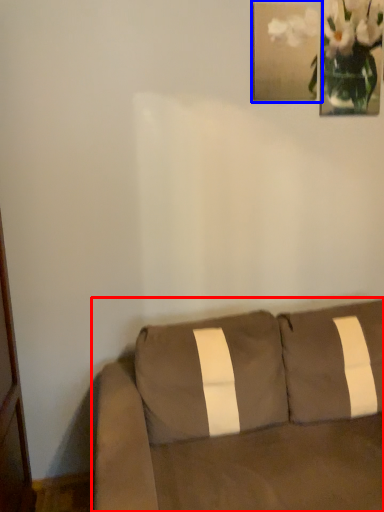
Question: Among these objects, which one is farthest to the camera, studio couch (highlighted by a red box) or picture frame (highlighted by a blue box)?

Choices:
 (A) studio couch
 (B) picture frame

Answer: (B)